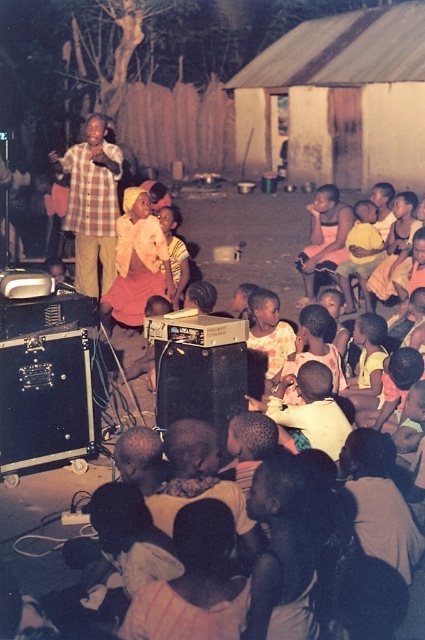
You are a photographer taking a picture of the plaid fabric shirt at center and the light brown skin at center. Which object will appear larger in the photo?

The plaid fabric shirt at center will appear larger in the photo because it is bigger than the light brown skin at center.